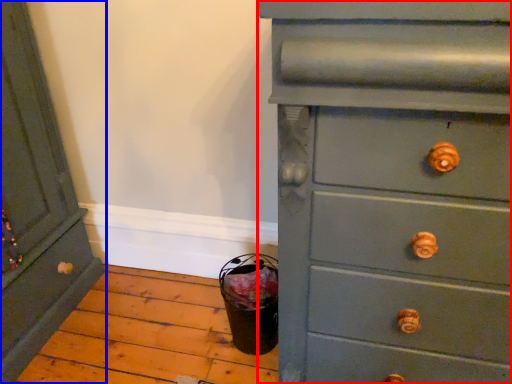
Question: Which of the following is the farthest to the observer, chest of drawers (highlighted by a red box) or chest of drawers (highlighted by a blue box)?

Choices:
 (A) chest of drawers
 (B) chest of drawers

Answer: (B)